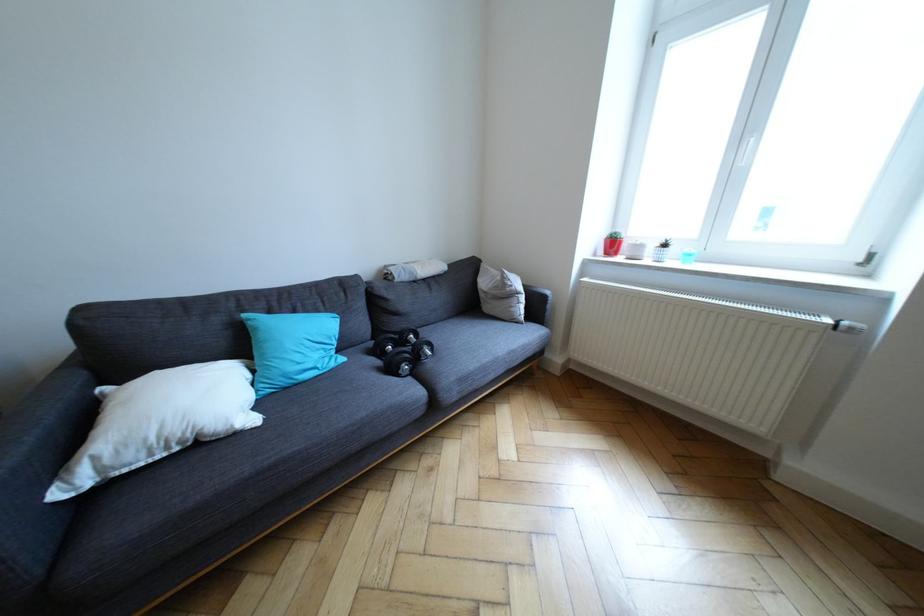
The height and width of the screenshot is (616, 924). Describe the element at coordinates (613, 243) in the screenshot. I see `the small red pot` at that location.